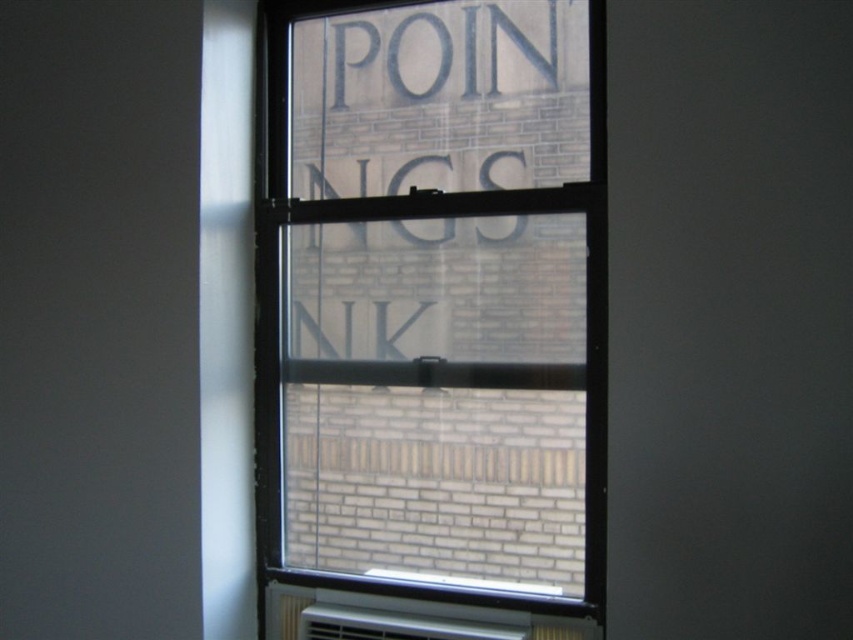
In the scene shown: Can you confirm if clear glass window at center is smaller than white plastic radiator at bottom?

No, clear glass window at center is not smaller than white plastic radiator at bottom.

Between point (318, 33) and point (531, 616), which one is positioned behind?

Point (318, 33)

Locate an element on the screen. clear glass window at center is located at coordinates (430, 320).